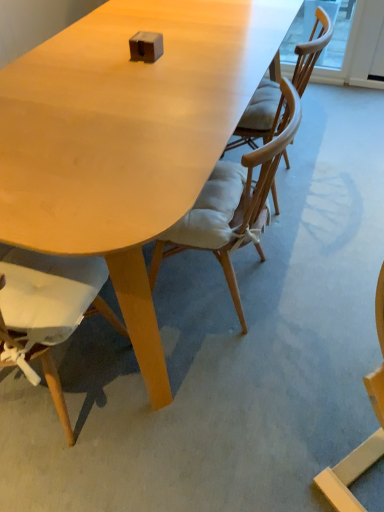
You are a GUI agent. You are given a task and a screenshot of the screen. Output one action in this format:
    pyautogui.click(x=<x>, y=<y>)
    Task: Click on the unoccupied region to the right of wooden chair with cushion at center, placed as the 1th chair when sorted from right to left
    This screenshot has height=512, width=384.
    Given the screenshot: What is the action you would take?
    pyautogui.click(x=334, y=180)